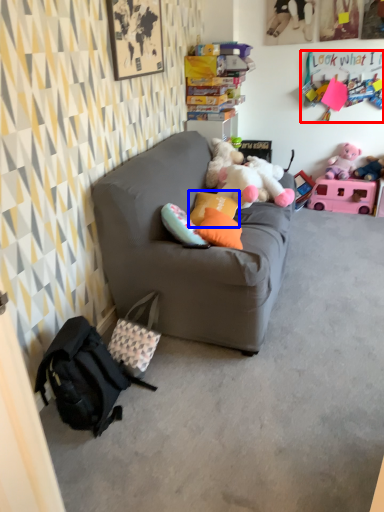
Question: Which of the following is the farthest to the observer, toy (highlighted by a red box) or pillow (highlighted by a blue box)?

Choices:
 (A) toy
 (B) pillow

Answer: (A)